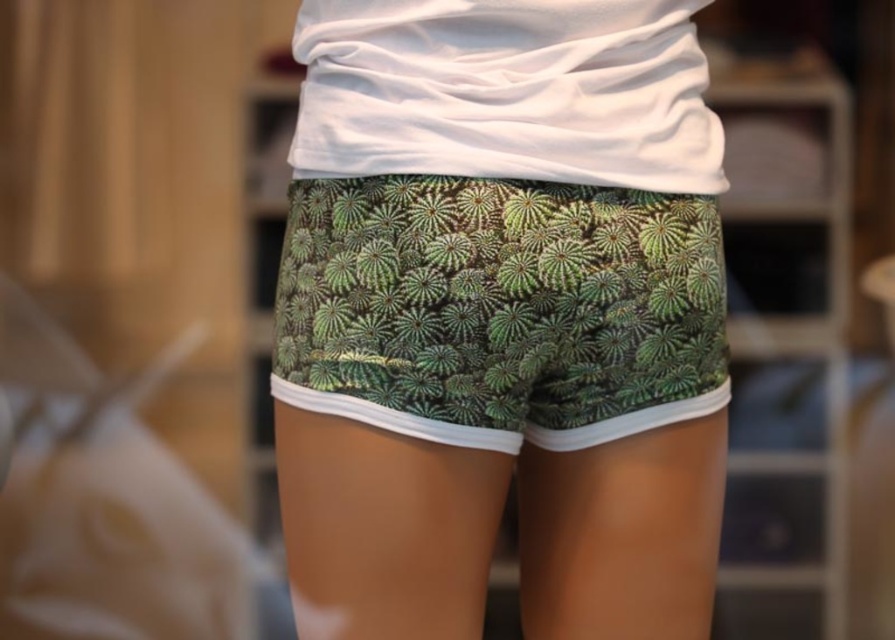
You are a photographer focusing on the green printed shorts at center and the green leafy fabric shorts at center. Which one is positioned to the right side?

The green printed shorts at center are positioned to the right of the green leafy fabric shorts at center.

Where is the green printed shorts at center located in terms of coordinates?

The green printed shorts at center is located at coordinates point (501, 316).